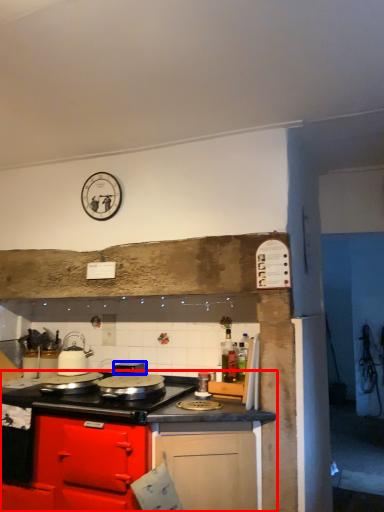
Question: Which object is further to the camera taking this photo, cabinetry (highlighted by a red box) or appliance (highlighted by a blue box)?

Choices:
 (A) cabinetry
 (B) appliance

Answer: (B)